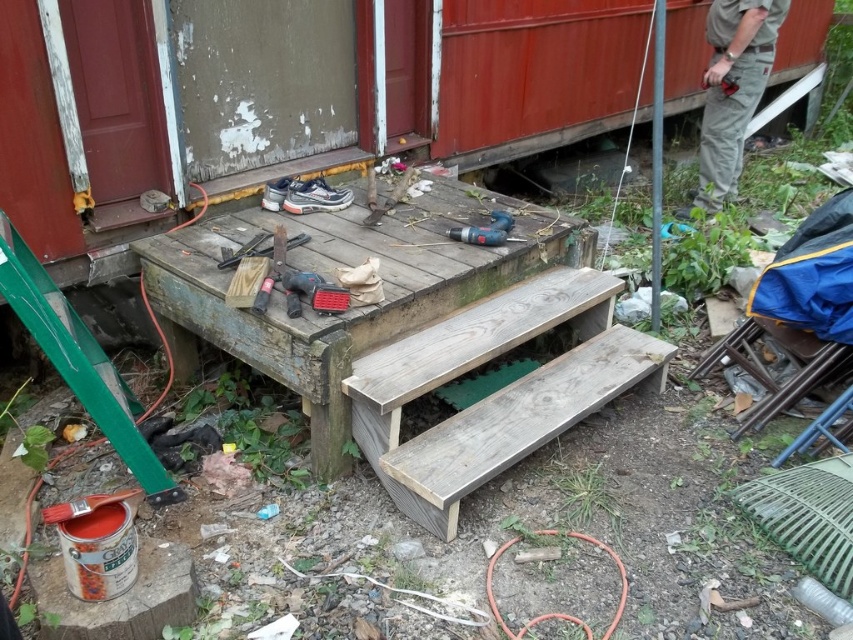
Question: Can you confirm if weathered wood picnic table at center is positioned to the left of khaki cotton pants at right?

Choices:
 (A) yes
 (B) no

Answer: (A)

Question: Is khaki cotton pants at right wider than blue plastic drill at center?

Choices:
 (A) no
 (B) yes

Answer: (B)

Question: Which of the following is the closest to the observer?

Choices:
 (A) (698, 180)
 (B) (492, 221)

Answer: (B)

Question: Which object is positioned closest to the blue plastic drill at center?

Choices:
 (A) weathered wood bench at center
 (B) khaki cotton pants at right
 (C) weathered wood picnic table at center

Answer: (C)

Question: Is weathered wood bench at center below khaki cotton pants at right?

Choices:
 (A) no
 (B) yes

Answer: (B)

Question: Which point is closer to the camera?

Choices:
 (A) weathered wood bench at center
 (B) blue plastic drill at center
 (C) khaki cotton pants at right

Answer: (A)